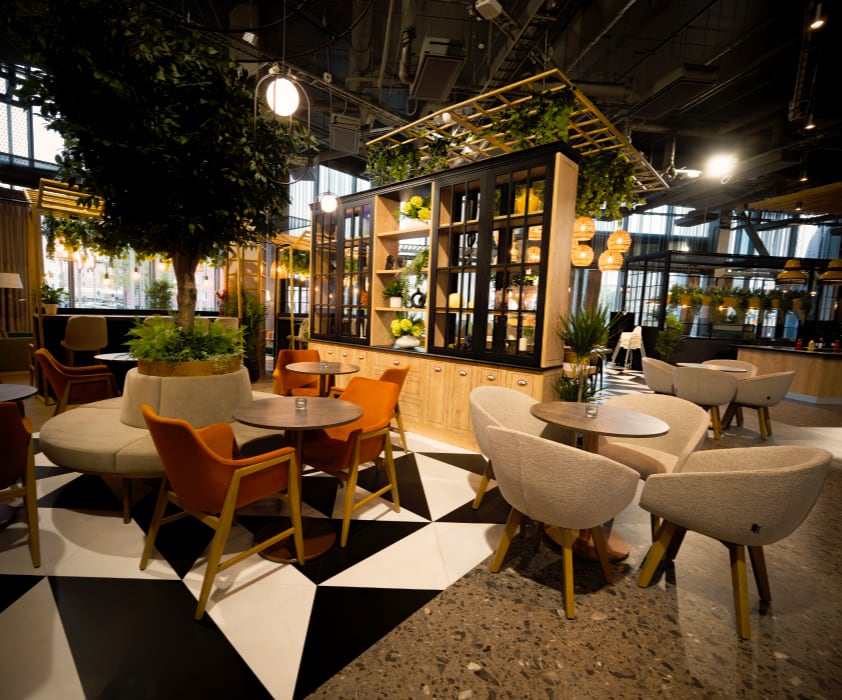
Find the location of a particular element. The width and height of the screenshot is (842, 700). black tiles is located at coordinates (173, 672), (173, 532), (88, 490), (352, 531), (336, 624), (313, 488), (393, 484), (476, 509), (451, 454), (36, 448).